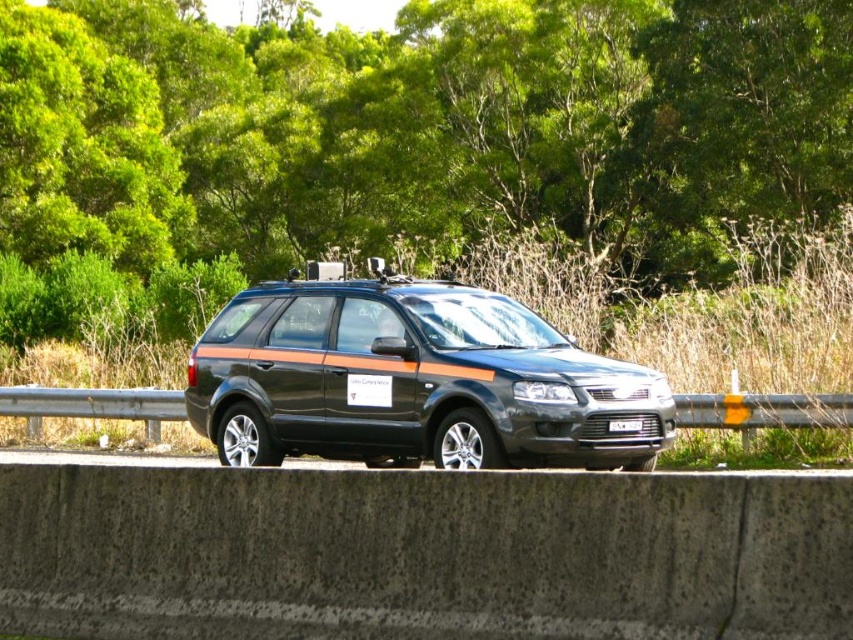
You are a delivery driver who needs to park your truck between the green leafy tree at center and the matte black minivan at center. Is there enough vertical space between them for your truck to fit?

The green leafy tree at center is much taller than the matte black minivan at center. Since the tree is significantly taller, there should be enough vertical space between them for your truck to fit comfortably.

You are a drone operator trying to capture a photo of the dark SUV with orange stripes. You need to position your drone so that it is exactly 40 meters away from the camera. The point at coordinates point (630,140) is already marked in the scene. Can you use this point to determine if your drone can be positioned correctly?

The point at coordinates point (630,140) is 38.34 meters from the camera. Since the required distance is 40 meters, the drone would need to be positioned slightly further away than this point to achieve the desired distance.

You are a drone operator trying to navigate your drone between the green leafy tree at center and the SUV parked behind the concrete barrier. The drone has a GPS coordinate system where the bottom left corner is the origin point. The tree is located at point 0.202, 0.494. Can you determine if the drone can safely pass between them without hitting either object?

The green leafy tree at center is located at point (x=421, y=129). Since the SUV is parked behind the concrete barrier, the distance between them must be considered. However, without specific coordinates for the SUV, it is impossible to determine if the drone can safely pass between them. Please provide the SUV coordinates for accurate calculation.